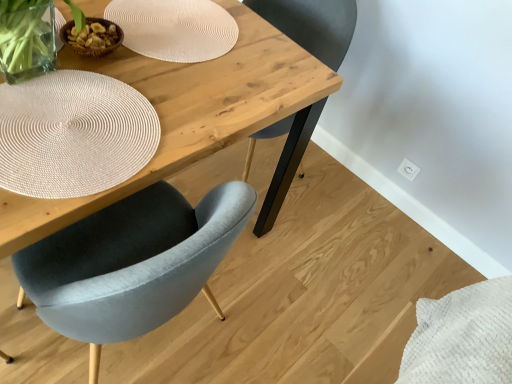
The width and height of the screenshot is (512, 384). I want to click on free point above white woven placemat at upper left, arranged as the second paper plate when viewed from the top (from a real-world perspective), so click(x=54, y=139).